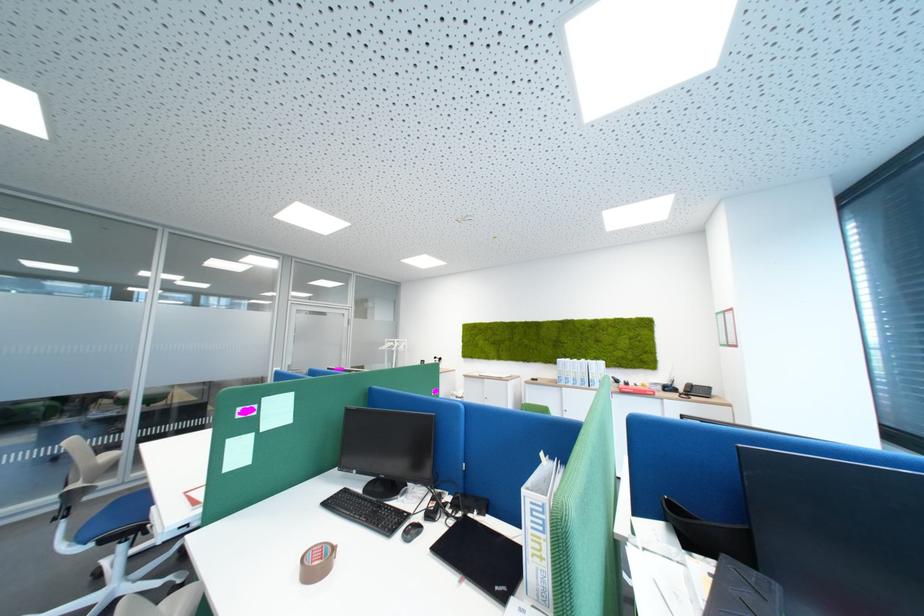
I want to click on brown tape dispenser, so click(x=315, y=562).